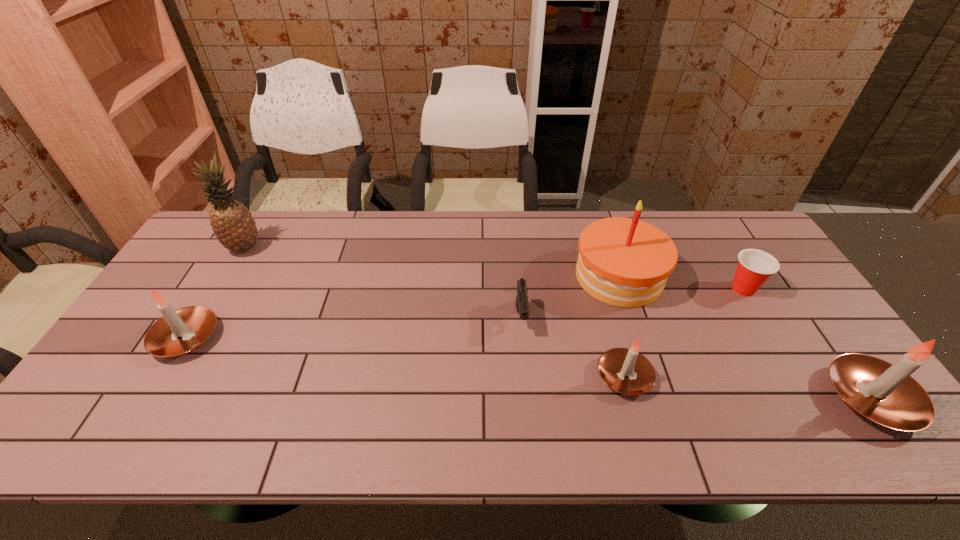
This screenshot has height=540, width=960. What are the coordinates of `the fourth shortest object` in the screenshot? It's located at (181, 331).

The height and width of the screenshot is (540, 960). In order to click on the leftmost candle in this screenshot , I will do `click(181, 331)`.

Locate an element on the screen. This screenshot has width=960, height=540. the second candle from left to right is located at coordinates 626,371.

Where is `the shortest candle`? the shortest candle is located at coordinates (626, 371).

Locate an element on the screen. The height and width of the screenshot is (540, 960). the rightmost candle is located at coordinates (884, 393).

Locate an element on the screen. This screenshot has width=960, height=540. the tallest candle is located at coordinates (884, 393).

This screenshot has height=540, width=960. Find the location of `pineapple`. pineapple is located at coordinates (232, 222).

Find the location of a particular element. The image size is (960, 540). birthday cake is located at coordinates (625, 262).

The width and height of the screenshot is (960, 540). Find the location of `the third object from left to right`. the third object from left to right is located at coordinates (522, 307).

Find the location of a particular element. cup is located at coordinates (755, 266).